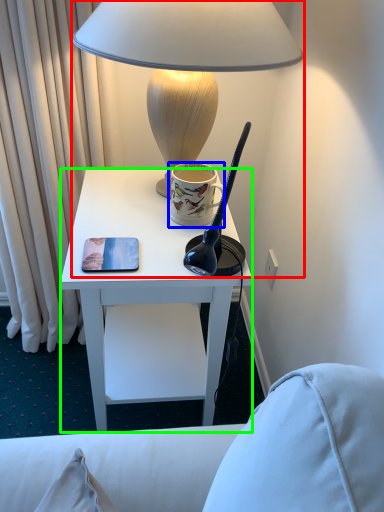
Question: Estimate the real-world distances between objects in this image. Which object is closer to lamp (highlighted by a red box), coffee cup (highlighted by a blue box) or desk (highlighted by a green box)?

Choices:
 (A) coffee cup
 (B) desk

Answer: (A)